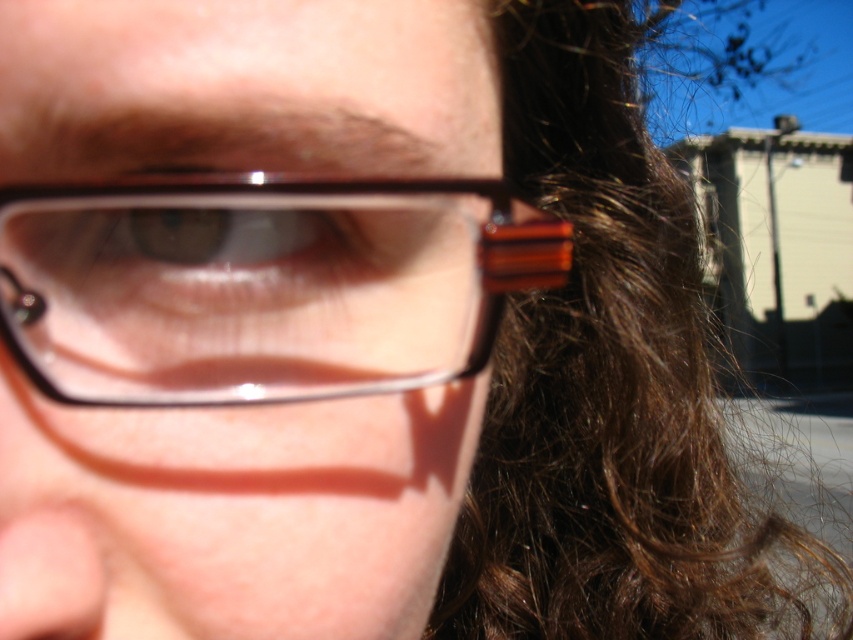
You are a photographer adjusting your camera settings to capture the translucent plastic glasses at center. Based on the scene description, where should you focus your camera to ensure the glasses are in sharp focus?

The translucent plastic glasses at center are located at point (263, 285), so you should focus your camera at that coordinate to ensure they are in sharp focus.

You are a photographer adjusting the focus on your camera. You notice the translucent plastic glasses at center and the brown glossy eye at center in the frame. Which object is positioned lower in the image?

The translucent plastic glasses at center is below brown glossy eye at center, so the translucent plastic glasses at center is positioned lower in the image.

You are taking a photo of a person wearing glasses with rectangular frames and brown lenses. You notice a point at coordinates (611, 388) in the image. Based on the scene description, what object or feature is located at that point?

The point at coordinates (611, 388) is located on the brown shiny hair at right.